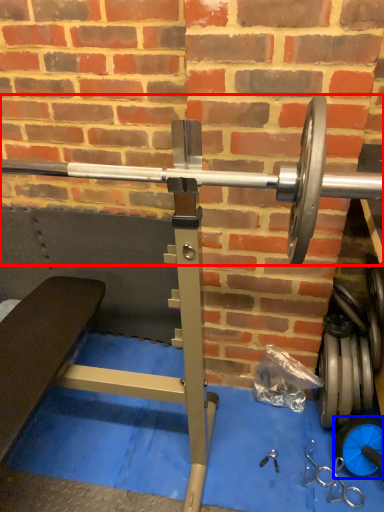
Question: Which of the following is the closest to the observer, barbell (highlighted by a red box) or dumbbell (highlighted by a blue box)?

Choices:
 (A) barbell
 (B) dumbbell

Answer: (A)